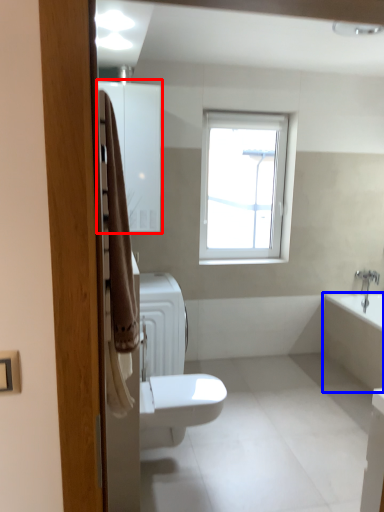
Question: Which point is closer to the camera, medicine cabinet (highlighted by a red box) or bath (highlighted by a blue box)?

Choices:
 (A) medicine cabinet
 (B) bath

Answer: (A)